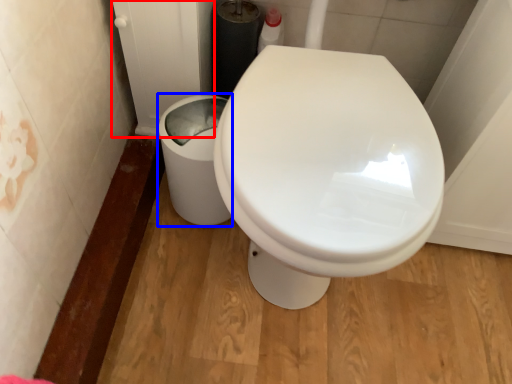
Question: Which point is further to the camera, screen door (highlighted by a red box) or porcelain (highlighted by a blue box)?

Choices:
 (A) screen door
 (B) porcelain

Answer: (B)